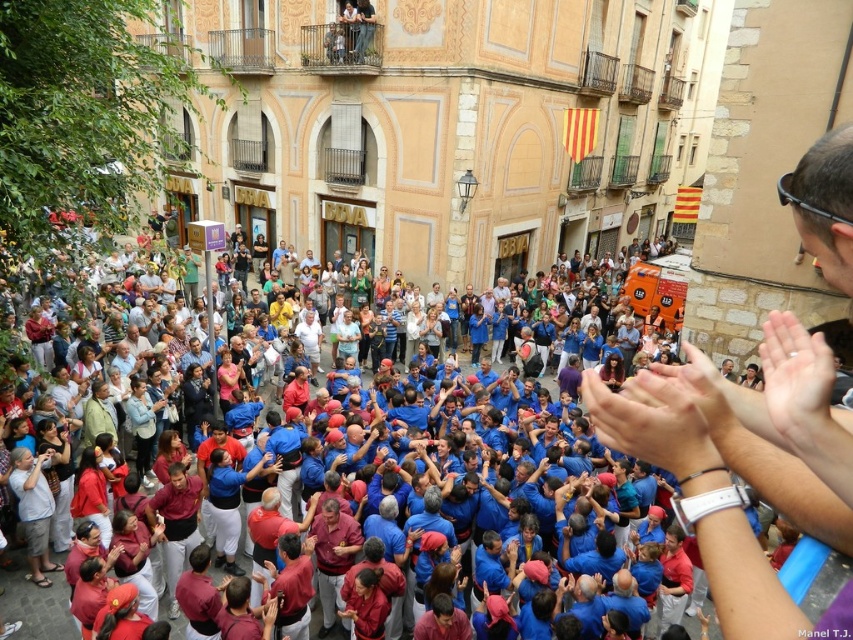
Question: Which object appears farthest from the camera in this image?

Choices:
 (A) matte black watch at upper right
 (B) blue fabric crowd at center

Answer: (B)

Question: Does matte black watch at upper right have a greater width compared to blue fabric crowd at center?

Choices:
 (A) yes
 (B) no

Answer: (B)

Question: Among these points, which one is farthest from the camera?

Choices:
 (A) (738, 413)
 (B) (840, 628)

Answer: (A)

Question: Can you confirm if matte black watch at upper right is positioned below blue fabric crowd at center?

Choices:
 (A) no
 (B) yes

Answer: (A)

Question: Is matte black watch at upper right further to camera compared to blue fabric crowd at center?

Choices:
 (A) no
 (B) yes

Answer: (A)